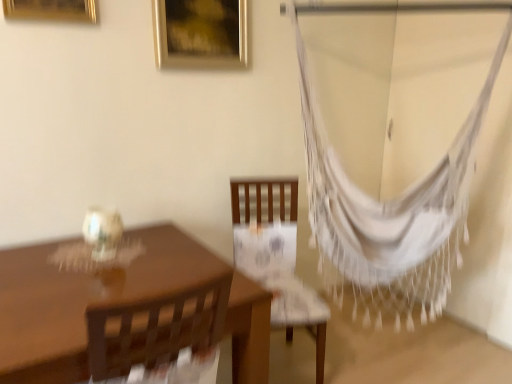
Question: Does gold metallic picture frame at upper center, the 1th picture frame viewed from the right, have a larger size compared to matte brown table at left?

Choices:
 (A) yes
 (B) no

Answer: (B)

Question: Considering the relative sizes of gold metallic picture frame at upper center, arranged as the first picture frame when viewed from the back, and matte brown table at left in the image provided, is gold metallic picture frame at upper center, arranged as the first picture frame when viewed from the back, smaller than matte brown table at left?

Choices:
 (A) yes
 (B) no

Answer: (A)

Question: Does gold metallic picture frame at upper center, arranged as the first picture frame when viewed from the back, appear on the left side of matte brown table at left?

Choices:
 (A) yes
 (B) no

Answer: (B)

Question: Considering the relative positions of gold metallic picture frame at upper center, the 1th picture frame viewed from the right, and matte brown table at left in the image provided, is gold metallic picture frame at upper center, the 1th picture frame viewed from the right, to the right of matte brown table at left from the viewer's perspective?

Choices:
 (A) no
 (B) yes

Answer: (B)

Question: Considering the relative sizes of gold metallic picture frame at upper center, placed as the 2th picture frame when sorted from front to back, and matte brown table at left in the image provided, is gold metallic picture frame at upper center, placed as the 2th picture frame when sorted from front to back, taller than matte brown table at left?

Choices:
 (A) yes
 (B) no

Answer: (B)

Question: Considering the positions of gold metallic picture frame at upper left, the 1th picture frame viewed from the front, and matte brown table at left in the image, is gold metallic picture frame at upper left, the 1th picture frame viewed from the front, wider or thinner than matte brown table at left?

Choices:
 (A) thin
 (B) wide

Answer: (A)

Question: From the image's perspective, relative to matte brown table at left, is gold metallic picture frame at upper left, the 1th picture frame viewed from the front, above or below?

Choices:
 (A) below
 (B) above

Answer: (B)

Question: Is gold metallic picture frame at upper left, which is the second picture frame from right to left, in front of or behind matte brown table at left in the image?

Choices:
 (A) front
 (B) behind

Answer: (B)

Question: Is gold metallic picture frame at upper left, the 1th picture frame viewed from the front, to the left or to the right of matte brown table at left in the image?

Choices:
 (A) right
 (B) left

Answer: (B)

Question: Is gold metallic picture frame at upper left, the 1th picture frame viewed from the front, to the left or to the right of gold metallic picture frame at upper center, the 1th picture frame viewed from the right, in the image?

Choices:
 (A) left
 (B) right

Answer: (A)

Question: Looking at their shapes, would you say gold metallic picture frame at upper left, which is the 1th picture frame from left to right, is wider or thinner than gold metallic picture frame at upper center, arranged as the first picture frame when viewed from the back?

Choices:
 (A) wide
 (B) thin

Answer: (B)

Question: From a real-world perspective, is gold metallic picture frame at upper left, the 1th picture frame viewed from the front, positioned above or below gold metallic picture frame at upper center, placed as the 2th picture frame when sorted from front to back?

Choices:
 (A) below
 (B) above

Answer: (B)

Question: Is point click(11, 4) closer or farther from the camera than point click(165, 38)?

Choices:
 (A) closer
 (B) farther

Answer: (A)

Question: From a real-world perspective, is white woven hammock at right positioned above or below wooden chair at center?

Choices:
 (A) above
 (B) below

Answer: (A)

Question: Considering the positions of white woven hammock at right and wooden chair at center in the image, is white woven hammock at right wider or thinner than wooden chair at center?

Choices:
 (A) wide
 (B) thin

Answer: (B)